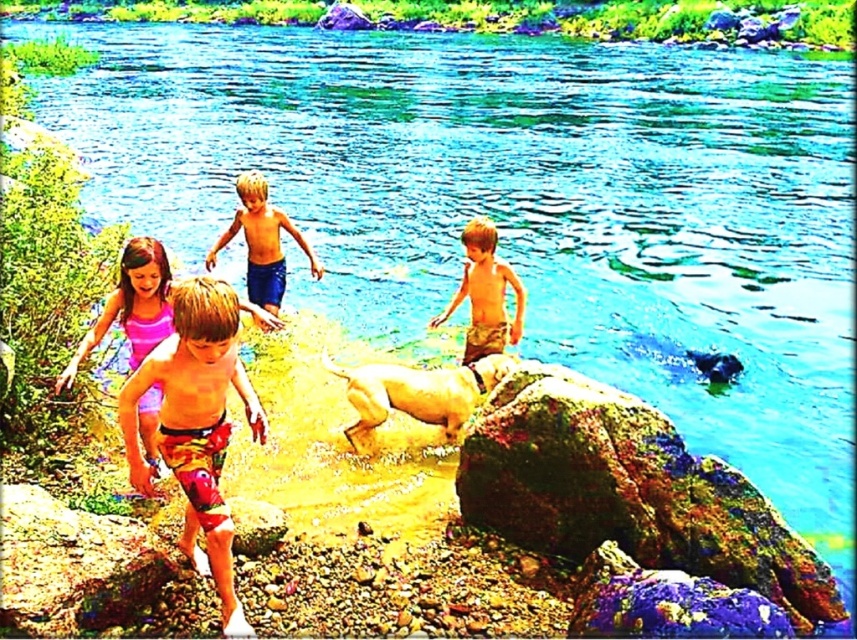
You are standing at the riverbank and want to pick up the multicolored textured rock at lower right and the camouflage shorts at center. Which object can you reach without moving your feet?

The multicolored textured rock at lower right is closer to the viewer than the camouflage shorts at center, so you can reach the multicolored textured rock at lower right without moving your feet.

You are standing at the riverbank and want to take a photo of both the point at coordinates point (x=716, y=564) and point (x=508, y=272). Which point will appear larger in your photo?

Point (x=716, y=564) is closer to the camera than point (x=508, y=272), so it will appear larger in the photo.

You are a photographer trying to capture a photo of the blue denim shorts at center and the multicolored textured rock at lower right. From your current position, which object is located to the right of the other?

The multicolored textured rock at lower right is positioned on the right side of blue denim shorts at center.